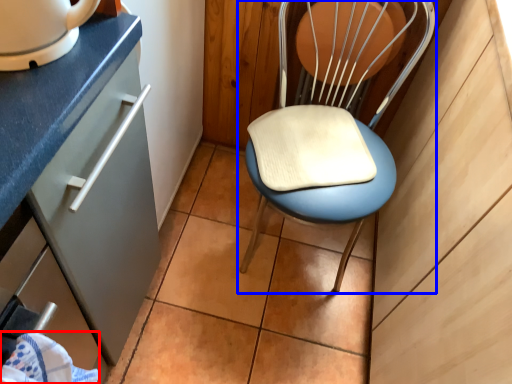
Question: Which point is closer to the camera, material (highlighted by a red box) or chair (highlighted by a blue box)?

Choices:
 (A) material
 (B) chair

Answer: (A)